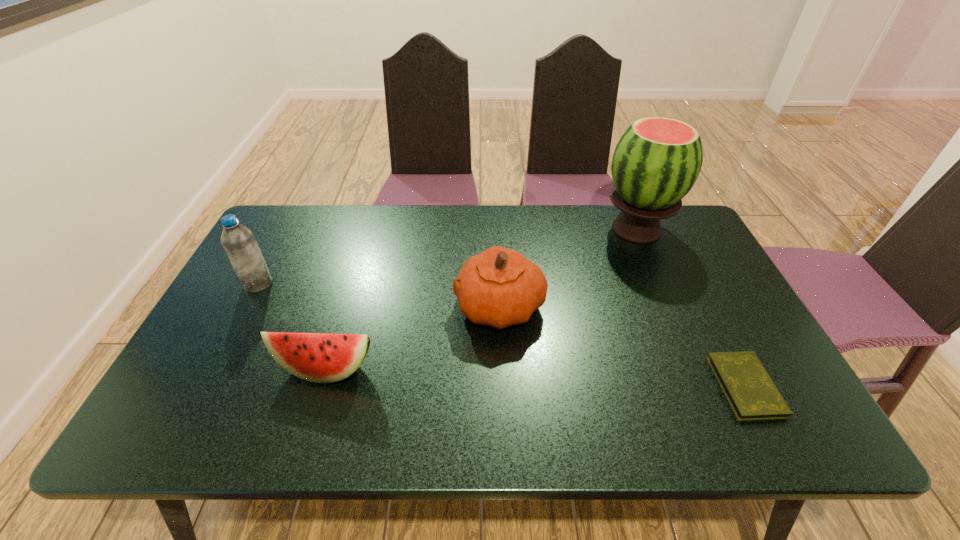
Find the location of a particular element. free region located on the right of the second tallest object is located at coordinates (312, 284).

Identify the location of vacant space located 0.320m on the front-facing side of the third object from left to right. (333, 306).

Identify the location of vacant space located on the front-facing side of the third object from left to right. This screenshot has width=960, height=540. (374, 306).

The image size is (960, 540). In order to click on vacant area located 0.280m on the front-facing side of the third object from left to right in this screenshot , I will do `click(348, 306)`.

The width and height of the screenshot is (960, 540). Identify the location of vacant space located on the outer rind of the fourth object from right to left. (310, 420).

Where is `vacant space located on the back of the shortest object`? vacant space located on the back of the shortest object is located at coordinates (691, 279).

Identify the location of object that is positioned at the far edge. This screenshot has height=540, width=960. (656, 162).

Image resolution: width=960 pixels, height=540 pixels. Find the location of `object that is at the near edge`. object that is at the near edge is located at coordinates (750, 391).

Image resolution: width=960 pixels, height=540 pixels. I want to click on object at the left edge, so click(x=238, y=241).

At what (x,y) coordinates should I click in order to perform the action: click on watermelon located in the right edge section of the desktop. Please return your answer as a coordinate pair (x, y). Image resolution: width=960 pixels, height=540 pixels. Looking at the image, I should click on (656, 162).